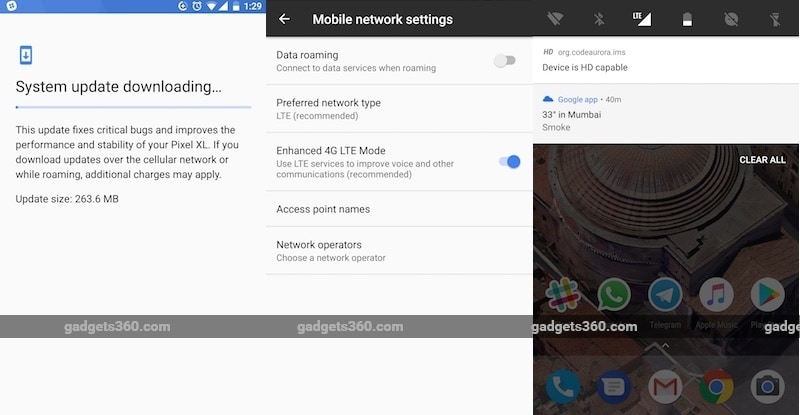
Identify the location of on toggle switch. (510, 162).